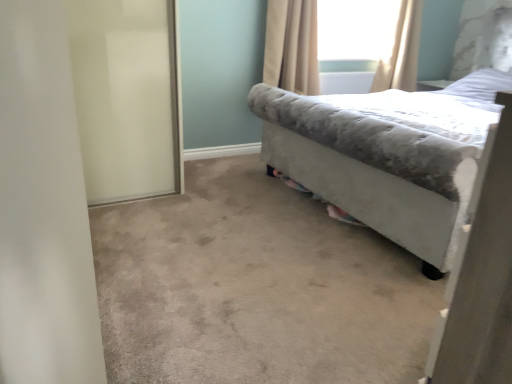
Question: From a real-world perspective, is transparent glass window screen at upper center positioned above or below beige fabric curtain at upper center, marked as the first curtain in a left-to-right arrangement?

Choices:
 (A) above
 (B) below

Answer: (A)

Question: Which is correct: transparent glass window screen at upper center is inside beige fabric curtain at upper center, the 2th curtain in the right-to-left sequence, or outside of it?

Choices:
 (A) outside
 (B) inside

Answer: (A)

Question: Estimate the real-world distances between objects in this image. Which object is closer to the beige fabric curtain at upper center, marked as the first curtain in a left-to-right arrangement?

Choices:
 (A) white frosted glass screen door at left
 (B) beige fabric curtain at upper right, which is counted as the first curtain, starting from the right
 (C) transparent glass window screen at upper center
 (D) velvet gray bed at right

Answer: (C)

Question: Which object is the closest to the beige fabric curtain at upper center, the 2th curtain in the right-to-left sequence?

Choices:
 (A) velvet gray bed at right
 (B) transparent glass window screen at upper center
 (C) white frosted glass screen door at left
 (D) beige fabric curtain at upper right, the second curtain positioned from the left

Answer: (B)